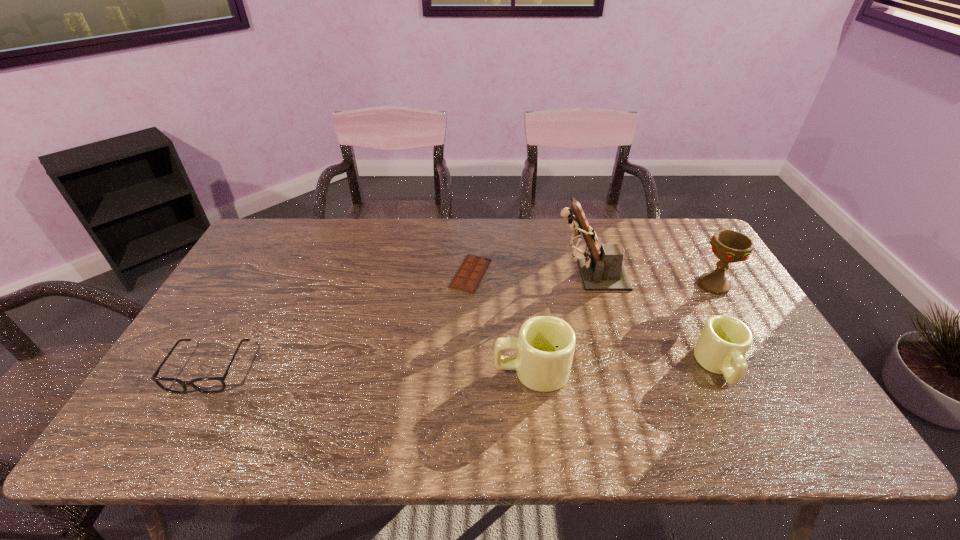
With all mugs evenly spaced, where should an extra mug be placed on the left to continue the pattern? Please point out a vacant space. Please provide its 2D coordinates. Your answer should be formatted as a tuple, i.e. [(x, y)], where the tuple contains the x and y coordinates of a point satisfying the conditions above.

[(340, 376)]